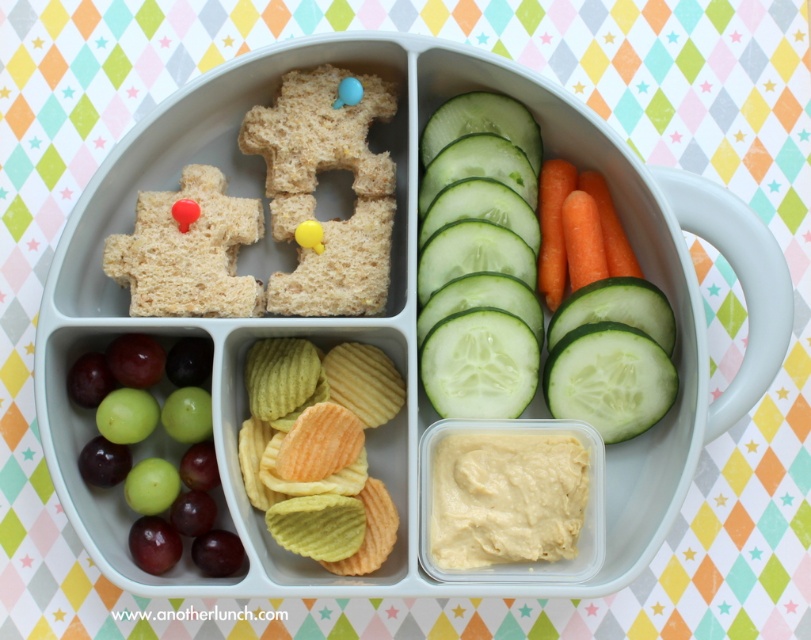
Question: Is green smooth cucumber at right to the right of green ridged chips at center from the viewer's perspective?

Choices:
 (A) no
 (B) yes

Answer: (B)

Question: Which point is farther to the camera?

Choices:
 (A) (445, 163)
 (B) (449, 401)
 (C) (372, 490)
 (D) (640, 349)

Answer: (A)

Question: Is green smooth cucumber at right behind green matte grapes at lower left?

Choices:
 (A) yes
 (B) no

Answer: (A)

Question: Estimate the real-world distances between objects in this image. Which object is closer to the green smooth cucumber at center right?

Choices:
 (A) green ridged chips at center
 (B) green smooth cucumber at right

Answer: (B)

Question: Which object is farther from the camera taking this photo?

Choices:
 (A) green smooth cucumber at center
 (B) green smooth cucumber at right
 (C) green ridged chips at center
 (D) green matte grapes at lower left

Answer: (A)

Question: Is green smooth cucumber at right below green smooth cucumber at center right?

Choices:
 (A) no
 (B) yes

Answer: (A)